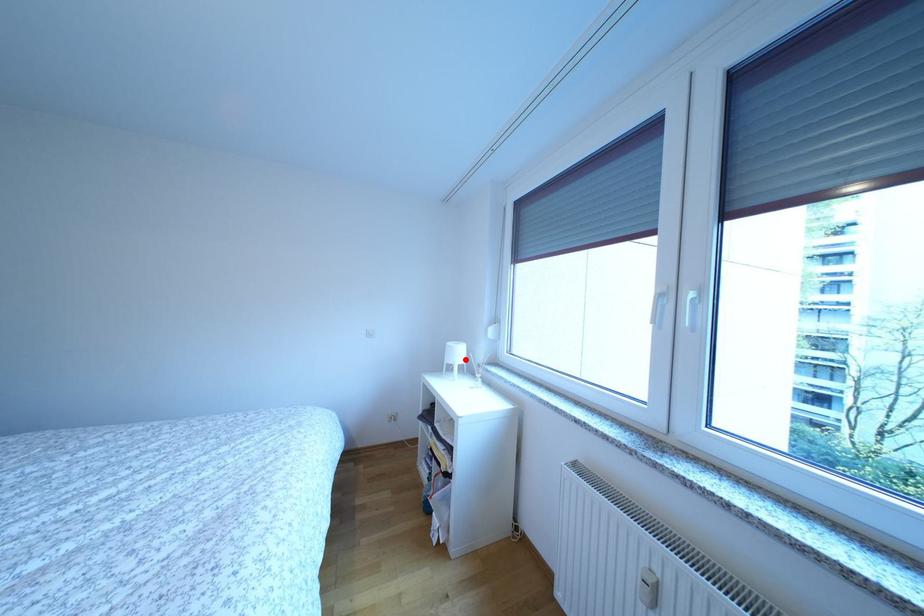
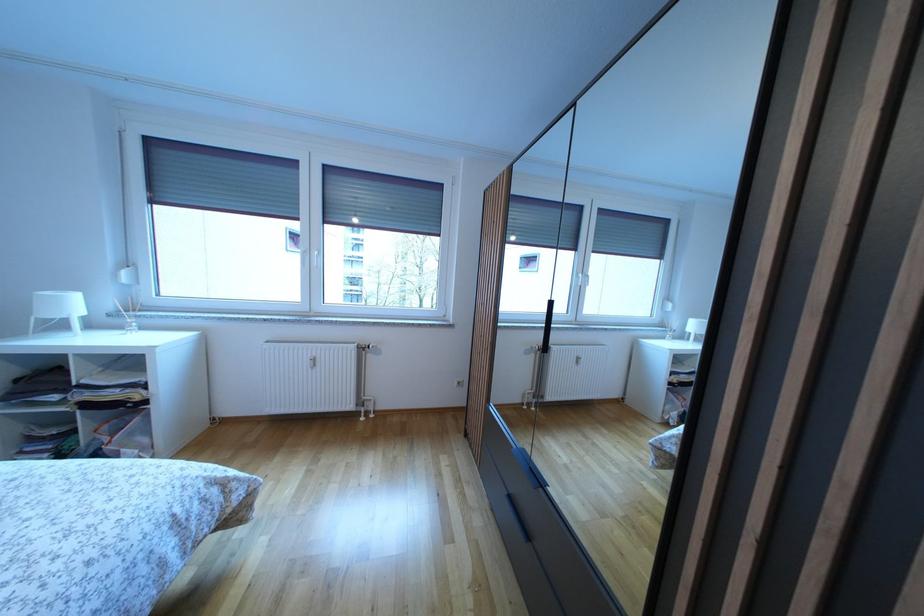
Locate, in the second image, the point that corresponds to the highlighted location in the first image.

(78, 310)